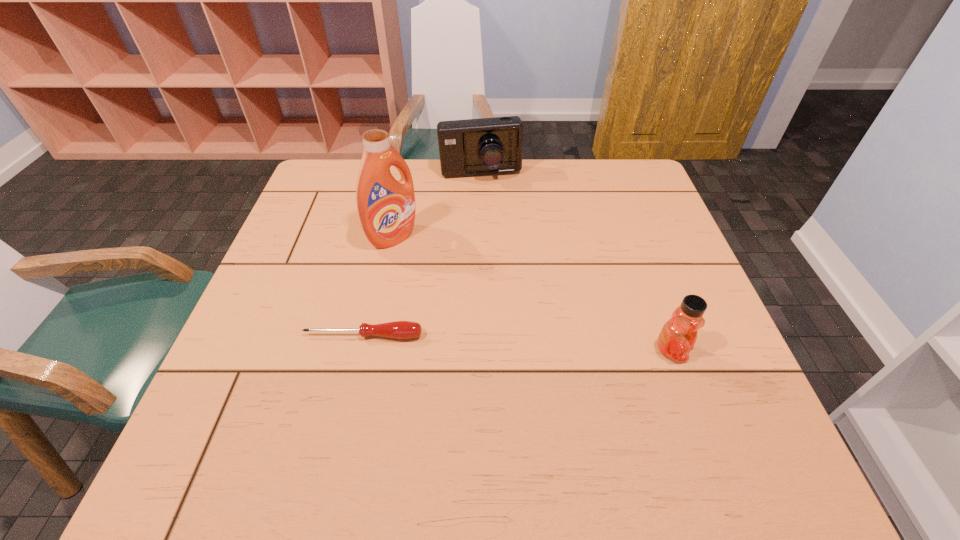
Where is `vacant area at the far left corner of the desktop`? vacant area at the far left corner of the desktop is located at coordinates (354, 176).

The height and width of the screenshot is (540, 960). Find the location of `vacant space at the far right corner of the desktop`. vacant space at the far right corner of the desktop is located at coordinates (614, 164).

Identify the location of vacant space at the near right corner of the desktop. (708, 387).

Image resolution: width=960 pixels, height=540 pixels. In order to click on free spot between the tallest object and the screwdriver in this screenshot , I will do `click(378, 286)`.

The width and height of the screenshot is (960, 540). Identify the location of vacant area between the screwdriver and the rightmost object. (517, 343).

Where is `free spot between the farthest object and the tallest object`? free spot between the farthest object and the tallest object is located at coordinates (437, 206).

In order to click on vacant point located between the screwdriver and the honey in this screenshot , I will do `click(517, 343)`.

You are a GUI agent. You are given a task and a screenshot of the screen. Output one action in this format:
    pyautogui.click(x=<x>, y=<y>)
    Task: Click on the free space between the screwdriver and the third nearest object
    This screenshot has width=960, height=540.
    Given the screenshot: What is the action you would take?
    pyautogui.click(x=378, y=286)

At what (x,y) coordinates should I click in order to perform the action: click on vacant space that's between the honey and the tallest object. Please return your answer as a coordinate pair (x, y). This screenshot has width=960, height=540. Looking at the image, I should click on (533, 294).

Identify the location of free space between the farthest object and the shortest object. (422, 255).